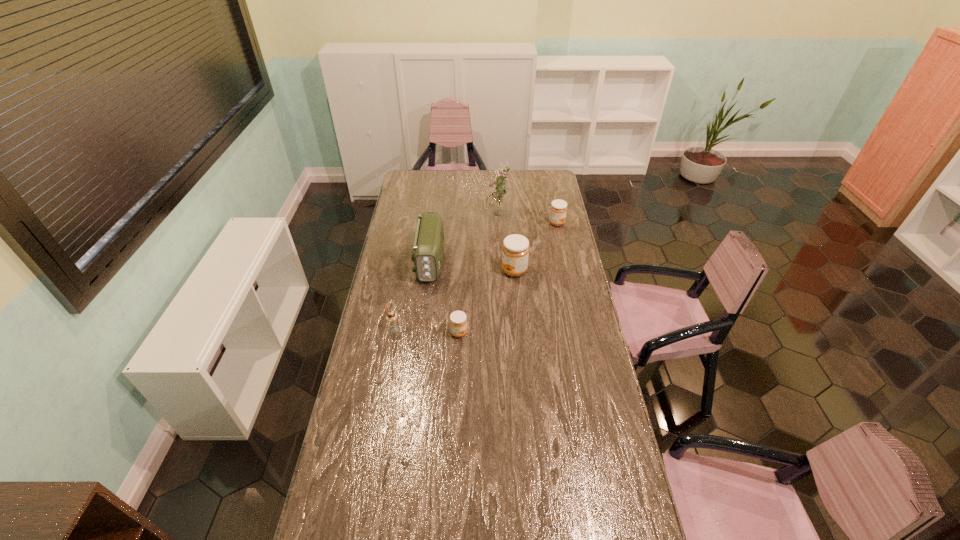
You are a GUI agent. You are given a task and a screenshot of the screen. Output one action in this format:
    pyautogui.click(x=<x>, y=<y>)
    Task: Click on the free area in between the leftmost object and the nearest jam
    
    Given the screenshot: What is the action you would take?
    pyautogui.click(x=426, y=331)

The width and height of the screenshot is (960, 540). In order to click on free spot between the icecream and the shortest object in this screenshot , I will do `click(426, 331)`.

You are a GUI agent. You are given a task and a screenshot of the screen. Output one action in this format:
    pyautogui.click(x=<x>, y=<y>)
    Task: Click on the free space between the second tallest jam and the tallest jam
    This screenshot has height=540, width=960.
    Given the screenshot: What is the action you would take?
    pyautogui.click(x=536, y=247)

Where is `vacant space that is in between the rightmost jam and the tallest jam`? The image size is (960, 540). vacant space that is in between the rightmost jam and the tallest jam is located at coordinates (536, 247).

At what (x,y) coordinates should I click in order to perform the action: click on vacant area that lies between the radio_receiver and the icecream. Please return your answer as a coordinate pair (x, y). The image size is (960, 540). Looking at the image, I should click on (412, 296).

The image size is (960, 540). Identify the location of object that is the fourth closest one to the shortest object. (497, 202).

Point out which object is positioned as the second nearest to the second shortest jam. Please provide its 2D coordinates. Your answer should be formatted as a tuple, i.e. [(x, y)], where the tuple contains the x and y coordinates of a point satisfying the conditions above.

[(515, 251)]

Locate which jam ranks in proximity to the farthest jam. Please provide its 2D coordinates. Your answer should be formatted as a tuple, i.e. [(x, y)], where the tuple contains the x and y coordinates of a point satisfying the conditions above.

[(515, 251)]

The width and height of the screenshot is (960, 540). What are the coordinates of `jam identified as the second closest to the fifth object from right to left` in the screenshot? It's located at (515, 251).

You are a GUI agent. You are given a task and a screenshot of the screen. Output one action in this format:
    pyautogui.click(x=<x>, y=<y>)
    Task: Click on the blank area in the image that satisfies the following two spatial constraints: 1. on the front label of the farthest jam; 2. on the front-facing side of the fifth object from right to left
    The image size is (960, 540).
    Given the screenshot: What is the action you would take?
    pyautogui.click(x=565, y=262)